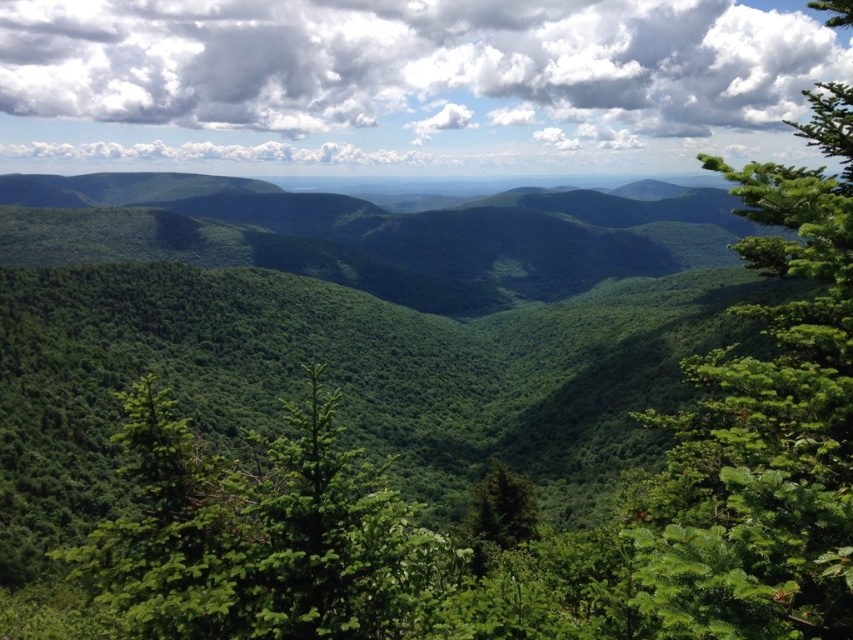
Is point (352, 81) positioned behind point (827, 141)?

Yes, it is behind point (827, 141).

Does white fluffy cloud at upper center appear over green leafy tree at right?

Indeed, white fluffy cloud at upper center is positioned over green leafy tree at right.

In order to click on white fluffy cloud at upper center in this screenshot , I will do 412,65.

Who is shorter, white fluffy cloud at upper center or green matte tree at center?

Standing shorter between the two is green matte tree at center.

Looking at this image, is white fluffy cloud at upper center closer to camera compared to green matte tree at center?

No.

Who is more distant from viewer, (3, 72) or (498, 513)?

Positioned behind is point (3, 72).

Image resolution: width=853 pixels, height=640 pixels. In order to click on white fluffy cloud at upper center in this screenshot , I will do `click(412, 65)`.

Is the position of green leafy forest at center less distant than that of white fluffy cloud at upper center?

That is True.

Does green leafy forest at center have a larger size compared to white fluffy cloud at upper center?

Yes, green leafy forest at center is bigger than white fluffy cloud at upper center.

The width and height of the screenshot is (853, 640). What do you see at coordinates (341, 342) in the screenshot?
I see `green leafy forest at center` at bounding box center [341, 342].

Identify the location of green leafy forest at center. The image size is (853, 640). (341, 342).